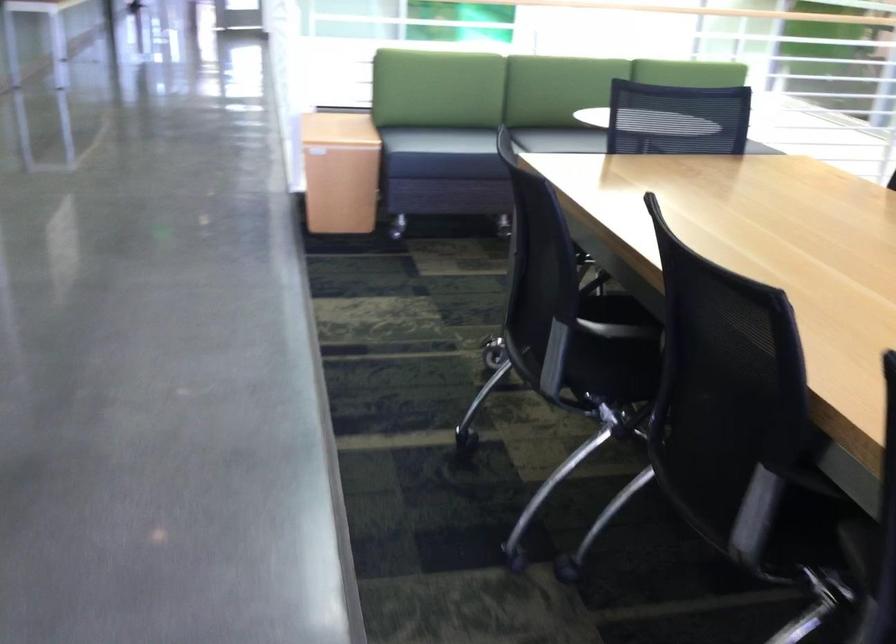
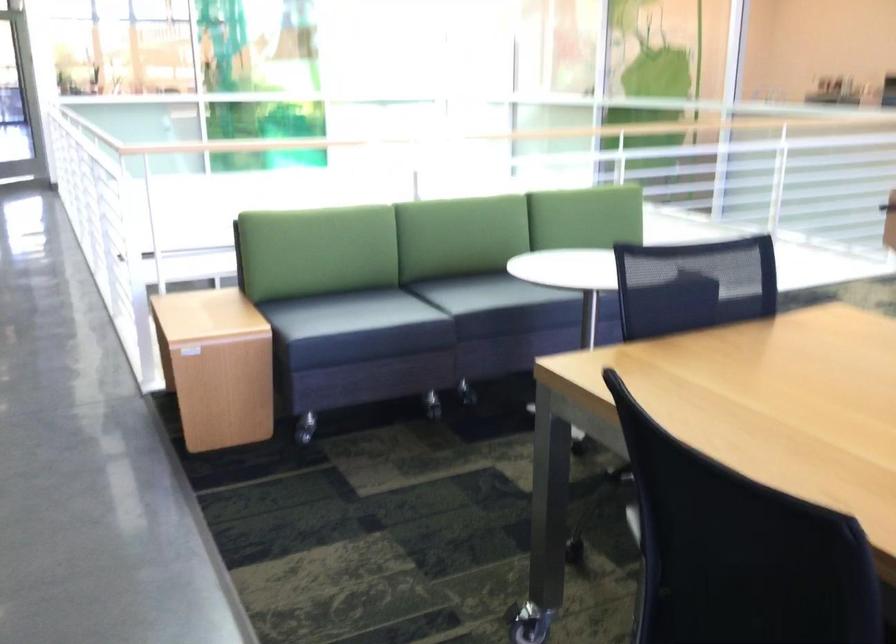
In a continuous first-person perspective shot, in which direction is the camera moving?

The cameraman moved toward left, forward.